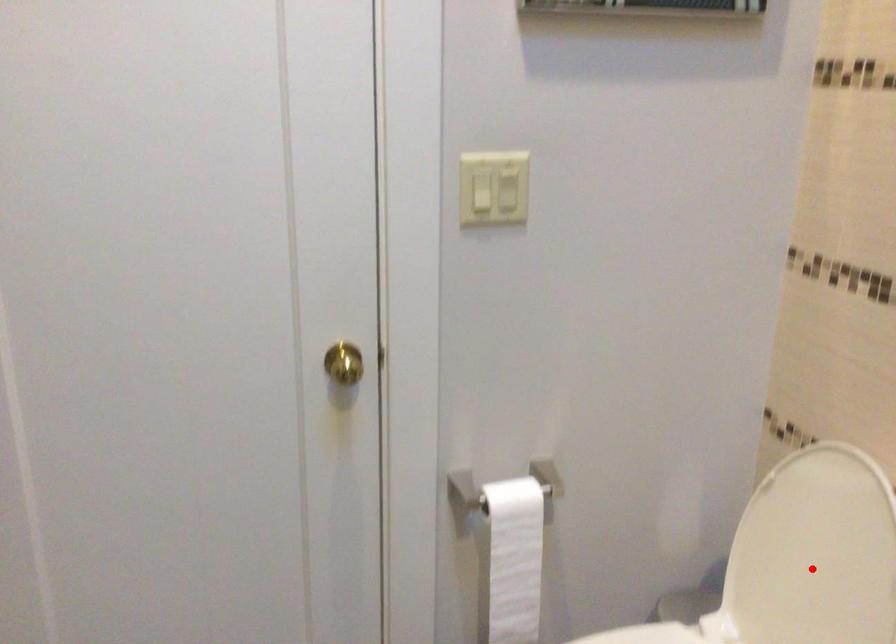
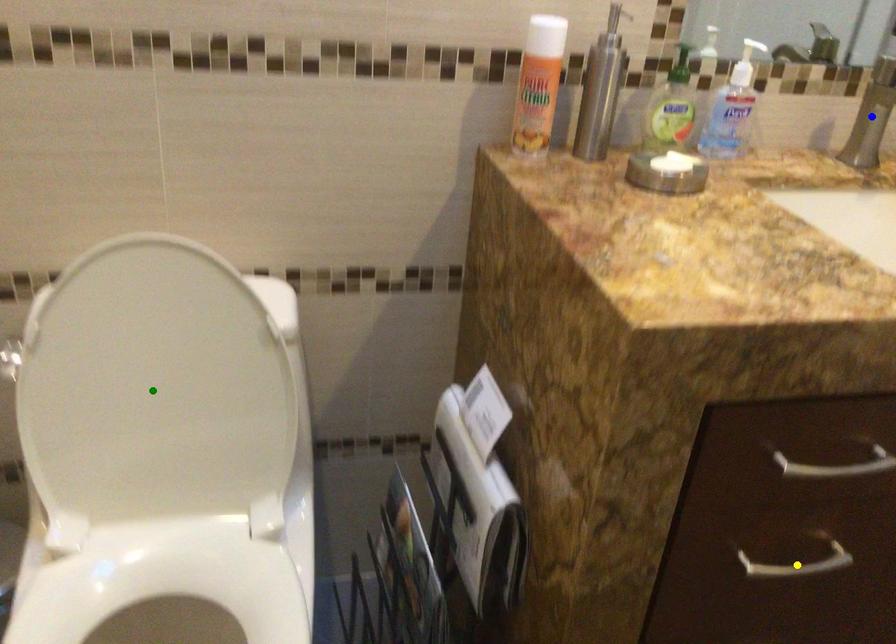
Question: I am providing you with two images of the same scene from different viewpoints. A red point is marked on the first image. You are given multiple points on the second image. Which point in image 2 represents the same 3d spot as the red point in image 1?

Choices:
 (A) yellow point
 (B) blue point
 (C) green point

Answer: (C)